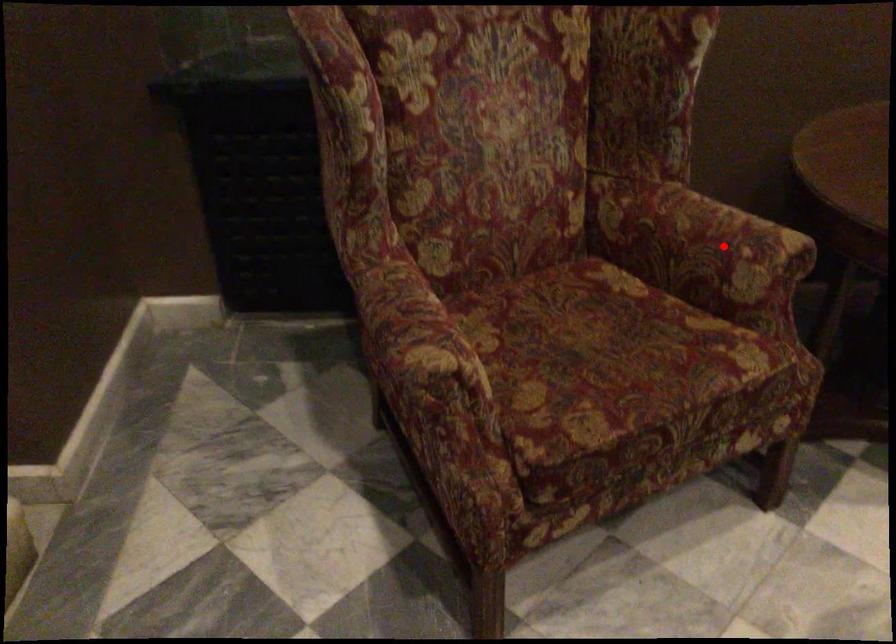
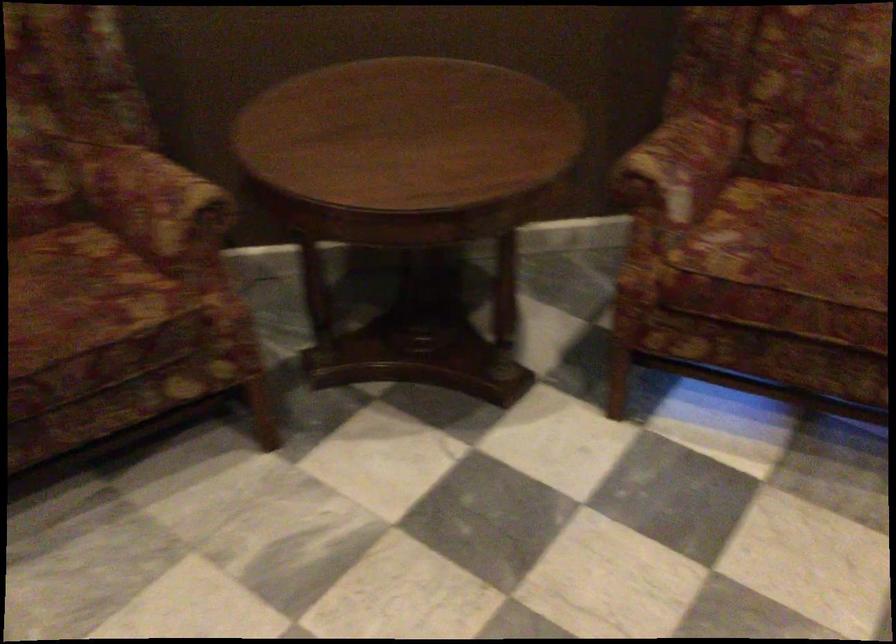
Where in the second image is the point corresponding to the highlighted location from the first image?

(156, 204)